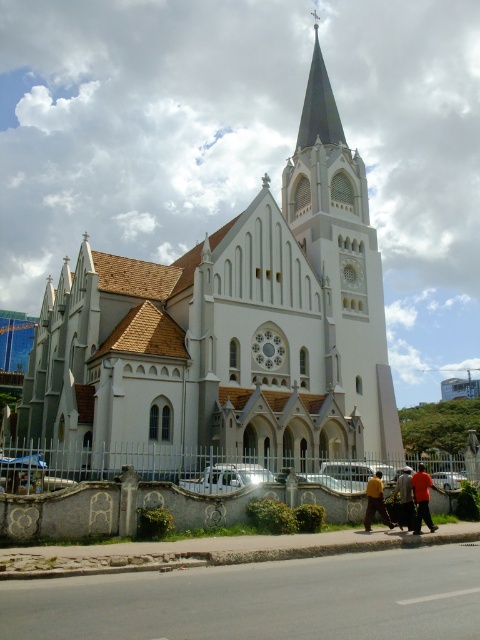
You are standing on the sidewalk in front of the church and want to take a photo of the white stone church at center and the smooth gray steeple at upper center. Based on their positions, which one should you frame first in your camera viewfinder to ensure both are fully visible?

You should frame the white stone church at center first because it is to the left of the smooth gray steeple at upper center, so positioning the church first ensures there is space to include the steeple on its right side.

In the scene shown: You are standing on the sidewalk in front of the white stone church at center and want to take a photo of the smooth gray steeple at upper center. Will the steeple be fully visible in your photo if you frame the shot to include the entire church?

The white stone church at center is in front of the smooth gray steeple at upper center, so the steeple may be partially obscured by the church in the photo unless you adjust your angle or position to ensure the steeple is not blocked.